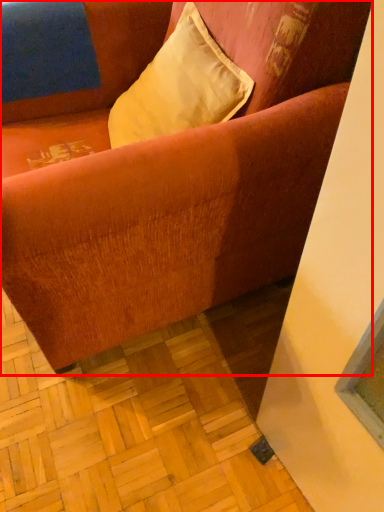
Question: From the image's perspective, where is studio couch (annotated by the red box) located relative to pillow?

Choices:
 (A) below
 (B) above

Answer: (A)